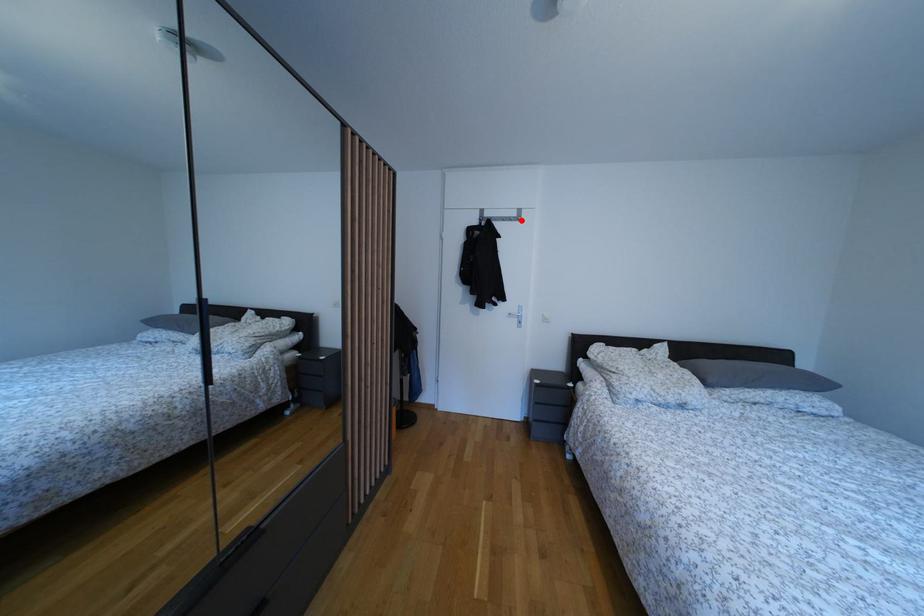
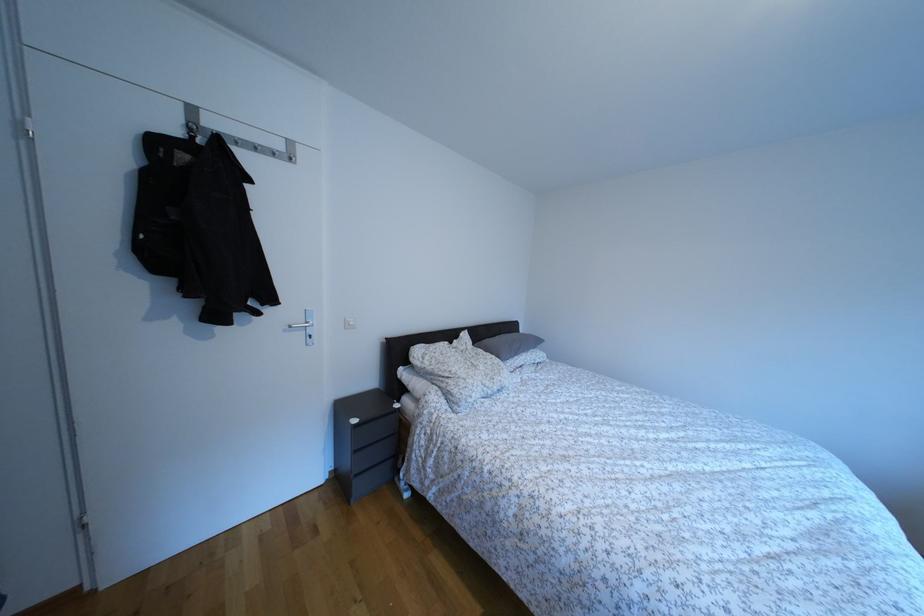
Locate, in the second image, the point that corresponds to the highlighted location in the first image.

(286, 152)